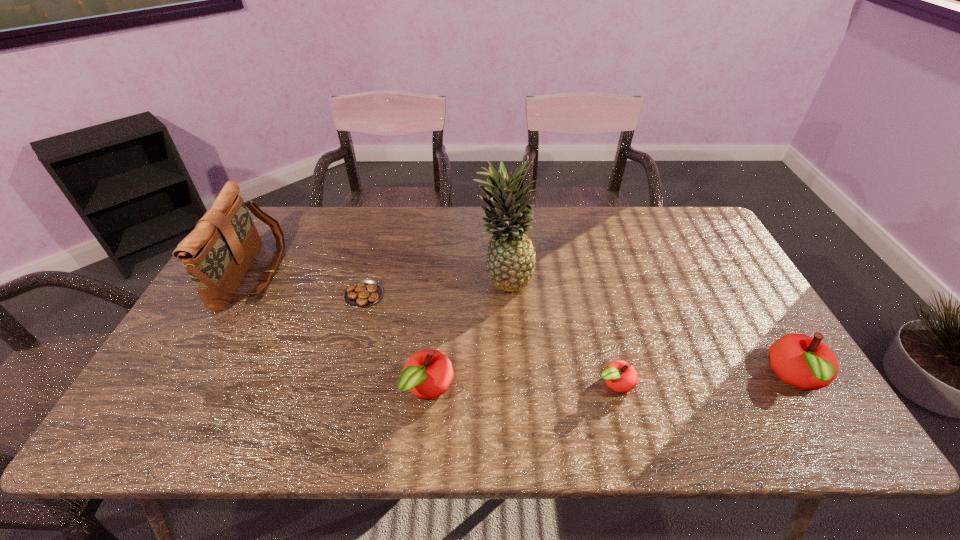
Locate an element on the screen. The height and width of the screenshot is (540, 960). object located in the far left corner section of the desktop is located at coordinates (217, 254).

Where is `object at the near right corner`? The width and height of the screenshot is (960, 540). object at the near right corner is located at coordinates (806, 363).

Locate an element on the screen. The width and height of the screenshot is (960, 540). vacant space at the far edge is located at coordinates (483, 221).

You are a GUI agent. You are given a task and a screenshot of the screen. Output one action in this format:
    pyautogui.click(x=<x>, y=<y>)
    Task: Click on the free space at the near edge
    
    Given the screenshot: What is the action you would take?
    pyautogui.click(x=492, y=391)

You are a GUI agent. You are given a task and a screenshot of the screen. Output one action in this format:
    pyautogui.click(x=<x>, y=<y>)
    Task: Click on the vacant point at the left edge
    This screenshot has height=540, width=960.
    Given the screenshot: What is the action you would take?
    pyautogui.click(x=174, y=353)

The height and width of the screenshot is (540, 960). In the image, there is a desktop. In order to click on free space at the far left corner in this screenshot , I will do `click(267, 227)`.

You are a GUI agent. You are given a task and a screenshot of the screen. Output one action in this format:
    pyautogui.click(x=<x>, y=<y>)
    Task: Click on the vacant region at the far right corner
    
    Given the screenshot: What is the action you would take?
    pyautogui.click(x=696, y=246)

You are a GUI agent. You are given a task and a screenshot of the screen. Output one action in this format:
    pyautogui.click(x=<x>, y=<y>)
    Task: Click on the free space that is in between the second object from left to right and the shortest apple
    
    Given the screenshot: What is the action you would take?
    pyautogui.click(x=489, y=339)

You are a GUI agent. You are given a task and a screenshot of the screen. Output one action in this format:
    pyautogui.click(x=<x>, y=<y>)
    Task: Click on the vacant area that lies between the fourth object from left to right and the shortest object
    This screenshot has width=960, height=540.
    Given the screenshot: What is the action you would take?
    pyautogui.click(x=434, y=286)

Find the location of `free space between the second object from right to left and the fifth shortest object`. free space between the second object from right to left and the fifth shortest object is located at coordinates (433, 328).